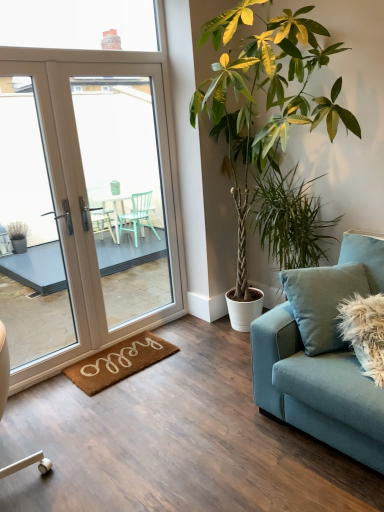
Question: Would you say green leafy plant at center, the 2th houseplant when ordered from left to right, is inside or outside transparent glass window at upper center?

Choices:
 (A) inside
 (B) outside

Answer: (B)

Question: Does point (309, 224) appear closer or farther from the camera than point (92, 37)?

Choices:
 (A) closer
 (B) farther

Answer: (B)

Question: Considering the real-world distances, which object is farthest from the white glossy door at left?

Choices:
 (A) teal fabric couch at right
 (B) white glossy door at left
 (C) green leafy plant at center, the first houseplant in the right-to-left sequence
 (D) transparent glass window at upper center
 (E) green leafy plant at center, which appears as the second houseplant when viewed from the right

Answer: (A)

Question: Which object is the closest to the brown coir mat at lower left?

Choices:
 (A) transparent glass window at upper center
 (B) green leafy plant at center, the first houseplant viewed from the left
 (C) green leafy plant at center, the 2th houseplant when ordered from left to right
 (D) white glossy door at left
 (E) teal fabric couch at right

Answer: (E)